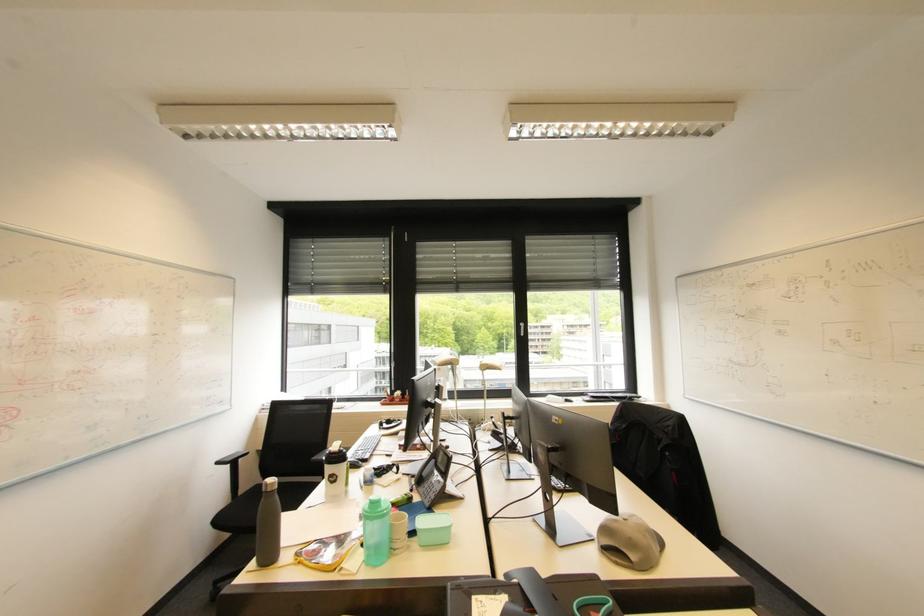
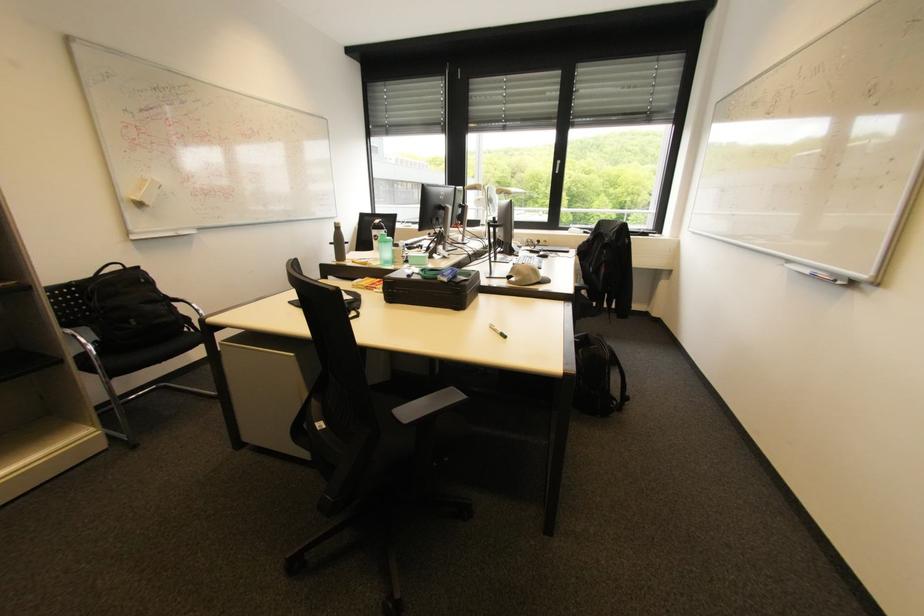
Locate, in the second image, the point that corresponds to point (223, 464) in the first image.

(335, 244)